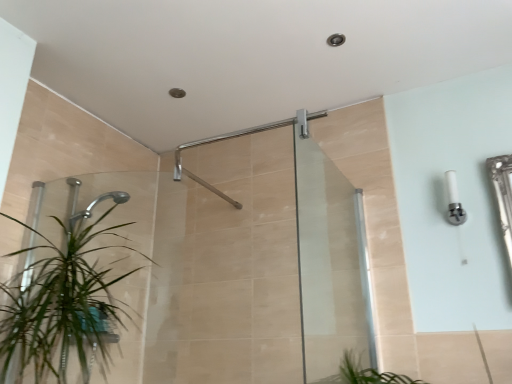
Question: Considering the relative sizes of matte silver shower arm at upper center and transparent glass screen door at center in the image provided, is matte silver shower arm at upper center wider than transparent glass screen door at center?

Choices:
 (A) no
 (B) yes

Answer: (B)

Question: Can you confirm if matte silver shower arm at upper center is positioned to the right of transparent glass screen door at center?

Choices:
 (A) yes
 (B) no

Answer: (B)

Question: Is matte silver shower arm at upper center outside of transparent glass screen door at center?

Choices:
 (A) no
 (B) yes

Answer: (B)

Question: Considering the relative sizes of matte silver shower arm at upper center and transparent glass screen door at center in the image provided, is matte silver shower arm at upper center shorter than transparent glass screen door at center?

Choices:
 (A) no
 (B) yes

Answer: (B)

Question: Could you tell me if matte silver shower arm at upper center is turned towards transparent glass screen door at center?

Choices:
 (A) no
 (B) yes

Answer: (B)

Question: Is point (347, 329) closer or farther from the camera than point (238, 201)?

Choices:
 (A) closer
 (B) farther

Answer: (A)

Question: Which is correct: transparent glass screen door at center is inside matte silver shower arm at upper center, or outside of it?

Choices:
 (A) outside
 (B) inside

Answer: (A)

Question: In terms of size, does transparent glass screen door at center appear bigger or smaller than matte silver shower arm at upper center?

Choices:
 (A) small
 (B) big

Answer: (B)

Question: Visually, is transparent glass screen door at center positioned to the left or to the right of matte silver shower arm at upper center?

Choices:
 (A) right
 (B) left

Answer: (A)

Question: From a real-world perspective, is white plastic light fixture at upper right physically located above or below green leafy plant at left?

Choices:
 (A) below
 (B) above

Answer: (B)

Question: Considering the relative positions of white plastic light fixture at upper right and green leafy plant at left in the image provided, is white plastic light fixture at upper right to the left or to the right of green leafy plant at left?

Choices:
 (A) right
 (B) left

Answer: (A)

Question: Considering their positions, is white plastic light fixture at upper right located in front of or behind green leafy plant at left?

Choices:
 (A) behind
 (B) front

Answer: (A)

Question: Is white plastic light fixture at upper right inside the boundaries of green leafy plant at left, or outside?

Choices:
 (A) inside
 (B) outside

Answer: (B)

Question: Does point (234, 206) appear closer or farther from the camera than point (108, 226)?

Choices:
 (A) closer
 (B) farther

Answer: (B)

Question: Is matte silver shower arm at upper center taller or shorter than green leafy plant at left?

Choices:
 (A) short
 (B) tall

Answer: (A)